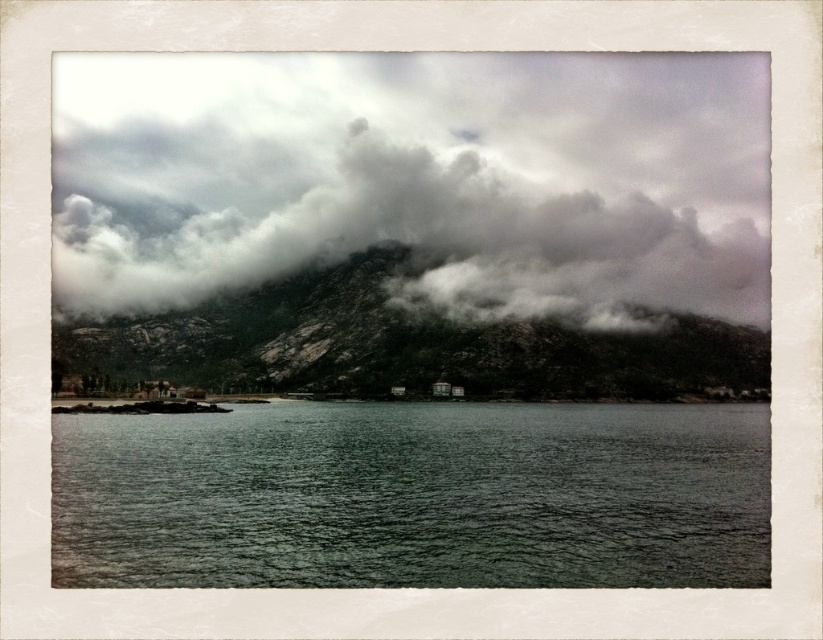
Can you confirm if cloudy gray sky at upper center is smaller than rocky gray mountain at center?

Actually, cloudy gray sky at upper center might be larger than rocky gray mountain at center.

Can you confirm if cloudy gray sky at upper center is wider than rocky gray mountain at center?

Yes, cloudy gray sky at upper center is wider than rocky gray mountain at center.

Is point (128, 243) positioned before point (226, 340)?

No, (128, 243) is further to viewer.

Where is `cloudy gray sky at upper center`? Image resolution: width=823 pixels, height=640 pixels. cloudy gray sky at upper center is located at coordinates (417, 177).

Which is more to the left, cloudy gray sky at upper center or dark gray water at center?

Positioned to the left is cloudy gray sky at upper center.

In the scene shown: Can you confirm if cloudy gray sky at upper center is positioned to the right of dark gray water at center?

In fact, cloudy gray sky at upper center is to the left of dark gray water at center.

This screenshot has width=823, height=640. What do you see at coordinates (417, 177) in the screenshot?
I see `cloudy gray sky at upper center` at bounding box center [417, 177].

The width and height of the screenshot is (823, 640). In order to click on cloudy gray sky at upper center in this screenshot , I will do click(417, 177).

Does dark gray water at center appear on the right side of rocky gray mountain at center?

Yes, dark gray water at center is to the right of rocky gray mountain at center.

Does dark gray water at center appear over rocky gray mountain at center?

No.

Does point (414, 422) come behind point (273, 330)?

That is False.

I want to click on dark gray water at center, so click(x=414, y=496).